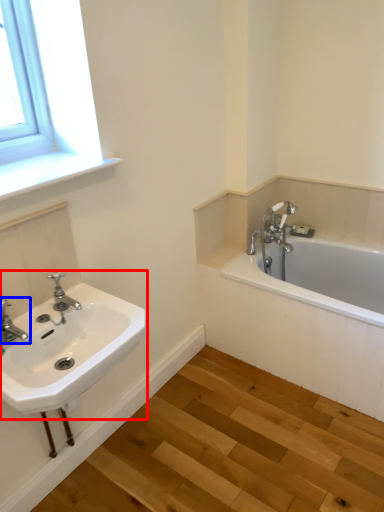
Question: Among these objects, which one is nearest to the camera, sink (highlighted by a red box) or tap (highlighted by a blue box)?

Choices:
 (A) sink
 (B) tap

Answer: (A)